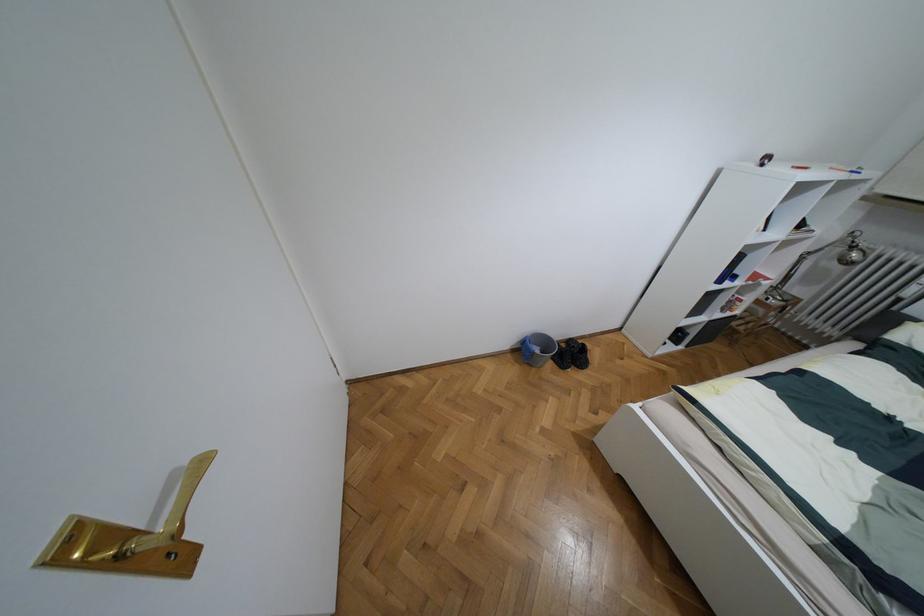
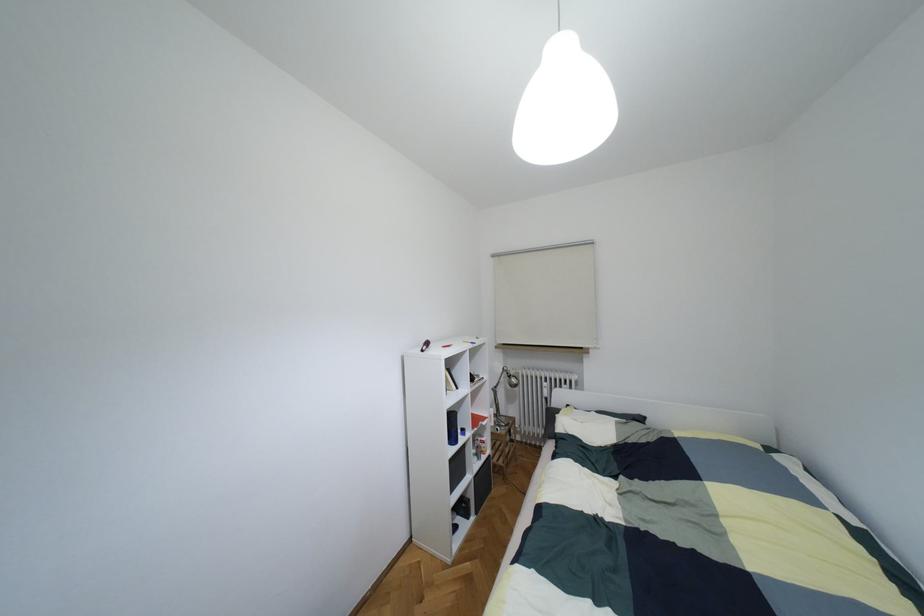
How did the camera likely rotate?

The rotation direction of the camera is right-up.